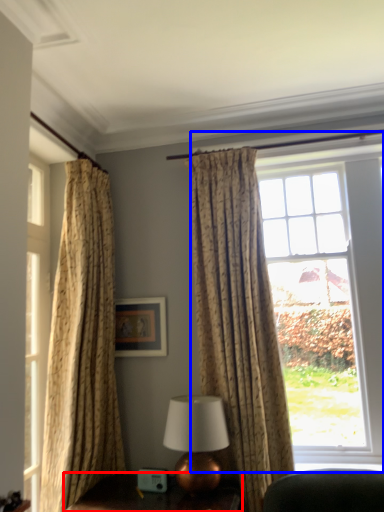
Question: Which point is closer to the camera, furniture (highlighted by a red box) or window (highlighted by a blue box)?

Choices:
 (A) furniture
 (B) window

Answer: (A)